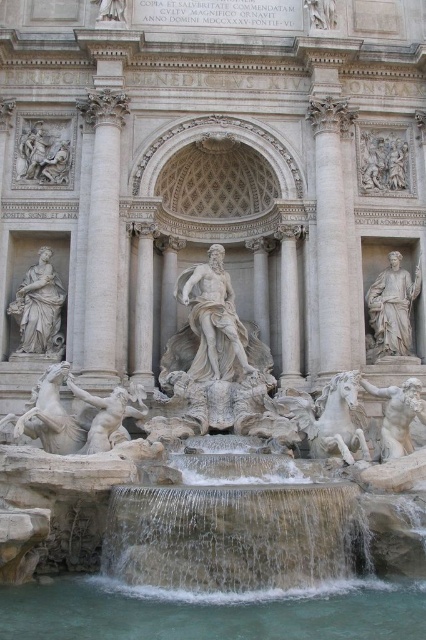
Which is more to the left, clear water at lower center or white marble statue at left?

From the viewer's perspective, white marble statue at left appears more on the left side.

Who is shorter, clear water at lower center or white marble statue at left?

With less height is clear water at lower center.

Which is in front, point (239, 627) or point (37, 324)?

Point (239, 627) is more forward.

Locate an element on the screen. clear water at lower center is located at coordinates (212, 611).

Is white marble statue at center behind white marble column at center-left?

That is False.

How distant is white marble statue at center from white marble column at center-left?

white marble statue at center and white marble column at center-left are 6.21 meters apart from each other.

Is point (238, 337) closer to viewer compared to point (141, 356)?

Yes, it is in front of point (141, 356).

The width and height of the screenshot is (426, 640). I want to click on white marble statue at center, so click(x=213, y=320).

Is white marble fountain at center taller than clear water at lower center?

Indeed, white marble fountain at center has a greater height compared to clear water at lower center.

Between white marble fountain at center and clear water at lower center, which one has less height?

clear water at lower center is shorter.

Is point (78, 492) in front of point (198, 625)?

No, (78, 492) is behind (198, 625).

Identify the location of white marble fountain at center. The height and width of the screenshot is (640, 426). (213, 506).